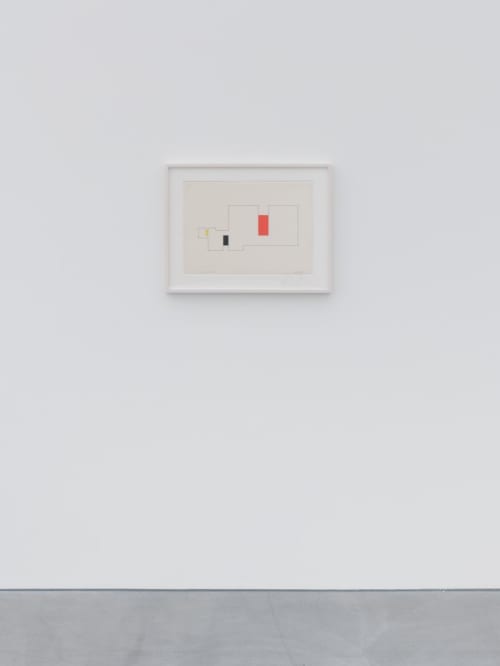
The width and height of the screenshot is (500, 666). I want to click on frame, so click(249, 164).